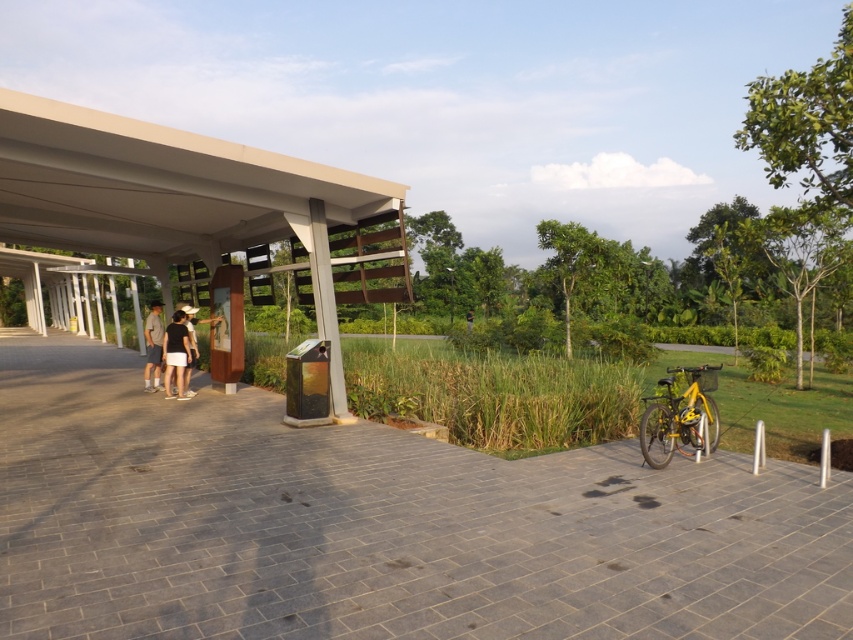
Question: Does gray brick path at center appear over black matte shorts at center?

Choices:
 (A) no
 (B) yes

Answer: (A)

Question: Which of the following is the closest to the observer?

Choices:
 (A) (378, 205)
 (B) (167, 396)

Answer: (A)

Question: Does gray brick path at center appear on the left side of matte white pergola at center?

Choices:
 (A) yes
 (B) no

Answer: (B)

Question: Which point is closer to the camera?

Choices:
 (A) (178, 369)
 (B) (390, 547)
 (C) (195, 252)

Answer: (B)

Question: Which object is closer to the camera taking this photo?

Choices:
 (A) black matte shorts at center
 (B) yellow matte bicycle at lower right
 (C) gray cotton shorts at left
 (D) gray brick path at center

Answer: (D)

Question: Can you confirm if gray brick path at center is positioned to the right of yellow matte bicycle at lower right?

Choices:
 (A) no
 (B) yes

Answer: (A)